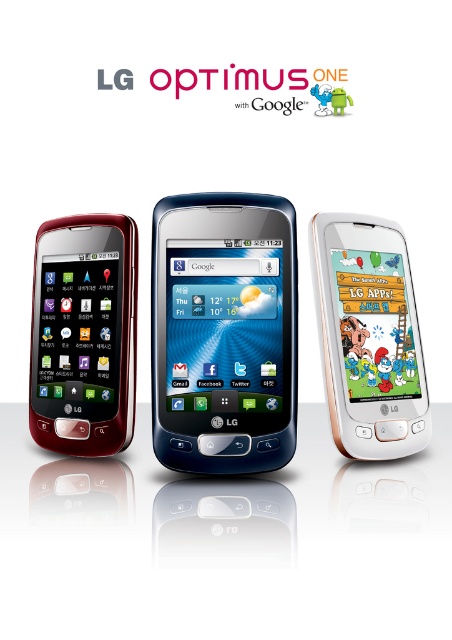
Question: Does metallic glossy phone at center appear over metallic blue lg optimus one at center?

Choices:
 (A) yes
 (B) no

Answer: (B)

Question: Estimate the real-world distances between objects in this image. Which object is farther from the white glossy smartphone at right?

Choices:
 (A) metallic glossy phone at center
 (B) matte black phone at left
 (C) metallic blue lg optimus one at center

Answer: (B)

Question: Can you confirm if matte black phone at left is thinner than white glossy smartphone at right?

Choices:
 (A) no
 (B) yes

Answer: (B)

Question: Does metallic glossy phone at center have a larger size compared to white glossy smartphone at right?

Choices:
 (A) yes
 (B) no

Answer: (A)

Question: Which of these objects is positioned closest to the white glossy smartphone at right?

Choices:
 (A) metallic blue lg optimus one at center
 (B) metallic glossy phone at center
 (C) matte black phone at left

Answer: (A)

Question: Among these points, which one is nearest to the camera?

Choices:
 (A) (381, 422)
 (B) (184, 362)

Answer: (B)